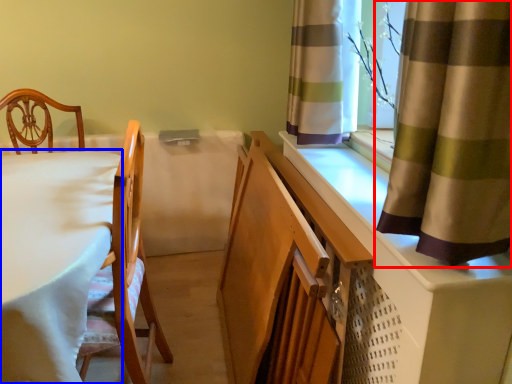
Question: Among these objects, which one is nearest to the camera, curtain (highlighted by a red box) or table (highlighted by a blue box)?

Choices:
 (A) curtain
 (B) table

Answer: (A)